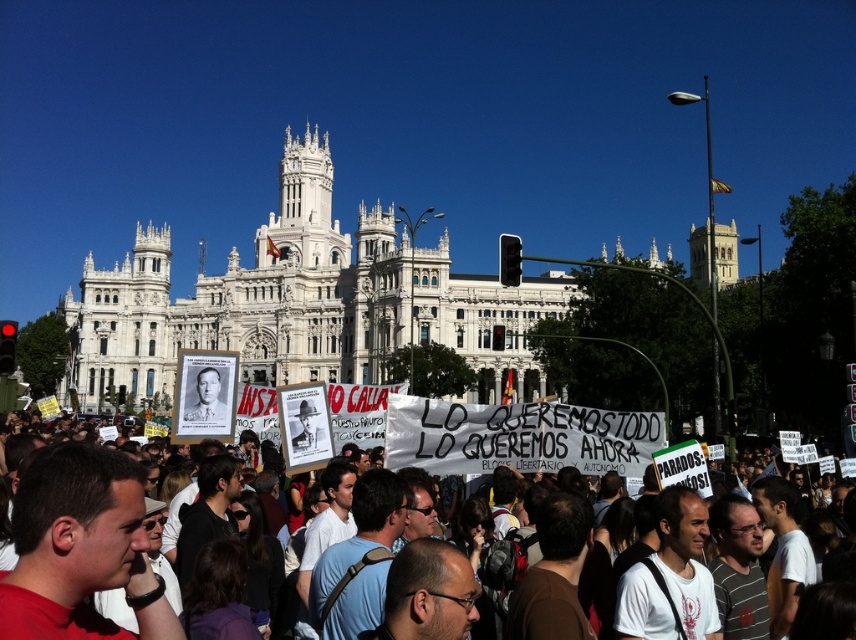
Identify the location of white stone building at center. (304, 301).

Does white stone building at center appear on the left side of white paper signs at center?

Indeed, white stone building at center is positioned on the left side of white paper signs at center.

At what (x,y) coordinates should I click in order to perform the action: click on white stone building at center. Please return your answer as a coordinate pair (x, y). The image size is (856, 640). Looking at the image, I should click on (304, 301).

The width and height of the screenshot is (856, 640). In order to click on white stone building at center in this screenshot , I will do `click(304, 301)`.